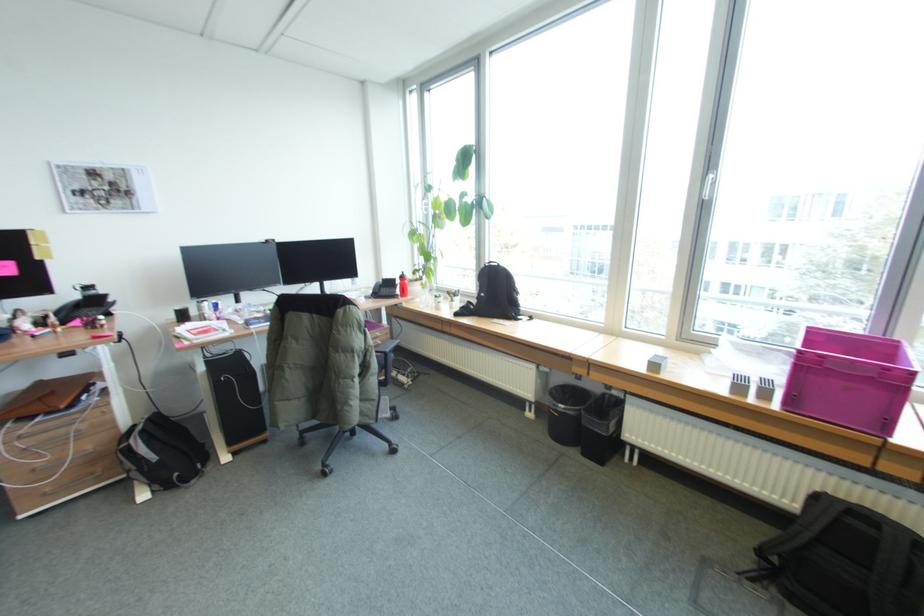
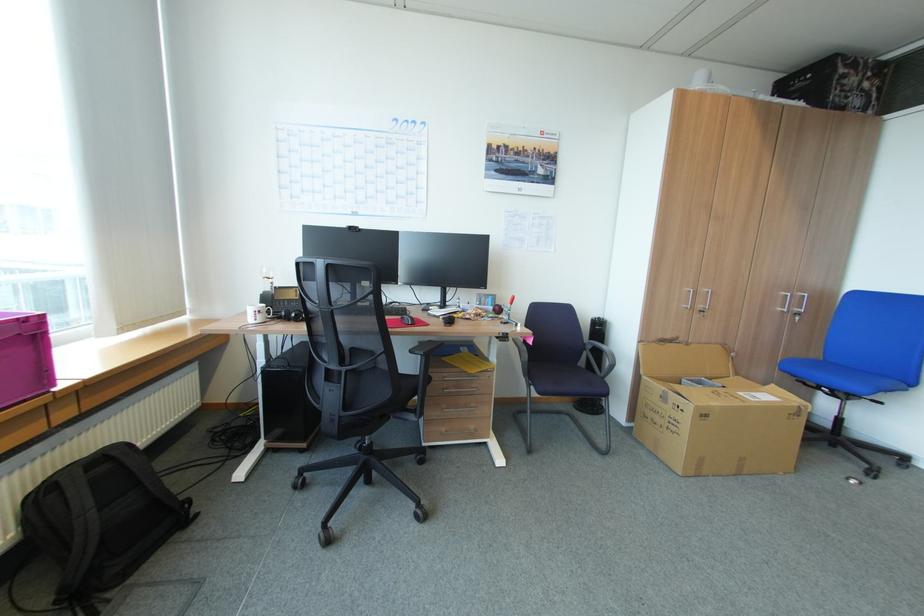
The point at [822,541] is marked in the first image. Where is the corresponding point in the second image?

(103, 511)